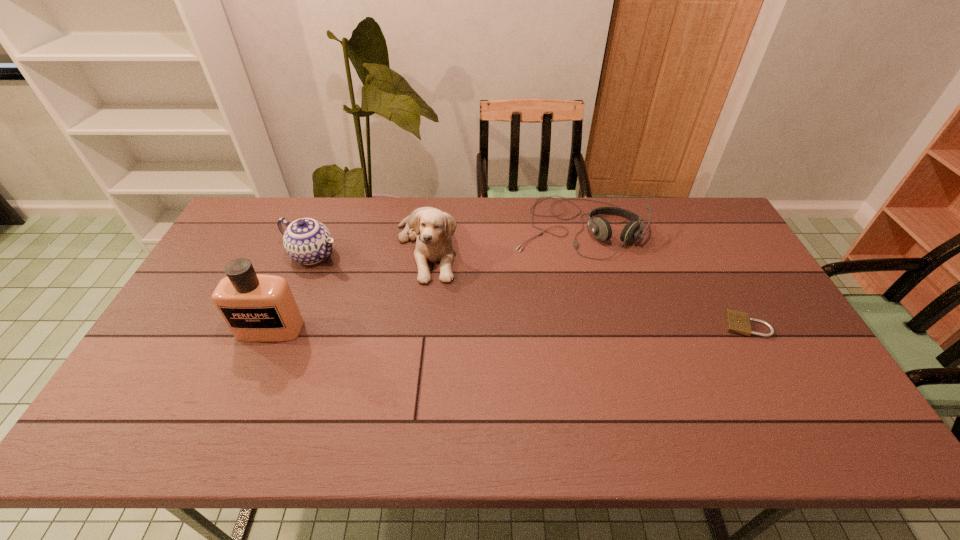
I want to click on vacant space located 0.060m on the front-facing side of the puppy, so click(x=439, y=297).

The height and width of the screenshot is (540, 960). What are the coordinates of `vacant point located 0.370m on the front-facing side of the puppy` in the screenshot? It's located at (472, 384).

At what (x,y) coordinates should I click in order to perform the action: click on vacant space positioned 0.320m on the front-facing side of the puppy. Please return your answer as a coordinate pair (x, y). Looking at the image, I should click on (466, 368).

Image resolution: width=960 pixels, height=540 pixels. Identify the location of vacant region located 0.070m on the outer surface of the second object from right to left. (570, 274).

I want to click on blank area located 0.210m on the outer surface of the second object from right to left, so click(x=567, y=308).

This screenshot has width=960, height=540. Find the location of `vacant space located 0.080m on the outer surface of the second object from right to left`. vacant space located 0.080m on the outer surface of the second object from right to left is located at coordinates (570, 276).

You are a GUI agent. You are given a task and a screenshot of the screen. Output one action in this format:
    pyautogui.click(x=<x>, y=<y>)
    Task: Click on the vacant position located at the spout of the third shortest object
    This screenshot has height=540, width=960.
    Given the screenshot: What is the action you would take?
    pyautogui.click(x=439, y=307)

Where is `free space located 0.320m at the spout of the third shortest object`? The height and width of the screenshot is (540, 960). free space located 0.320m at the spout of the third shortest object is located at coordinates (421, 299).

Find the location of a particular element. The width and height of the screenshot is (960, 540). free space located at the spout of the third shortest object is located at coordinates (424, 300).

This screenshot has height=540, width=960. In order to click on puppy that is at the far edge in this screenshot , I will do `click(433, 229)`.